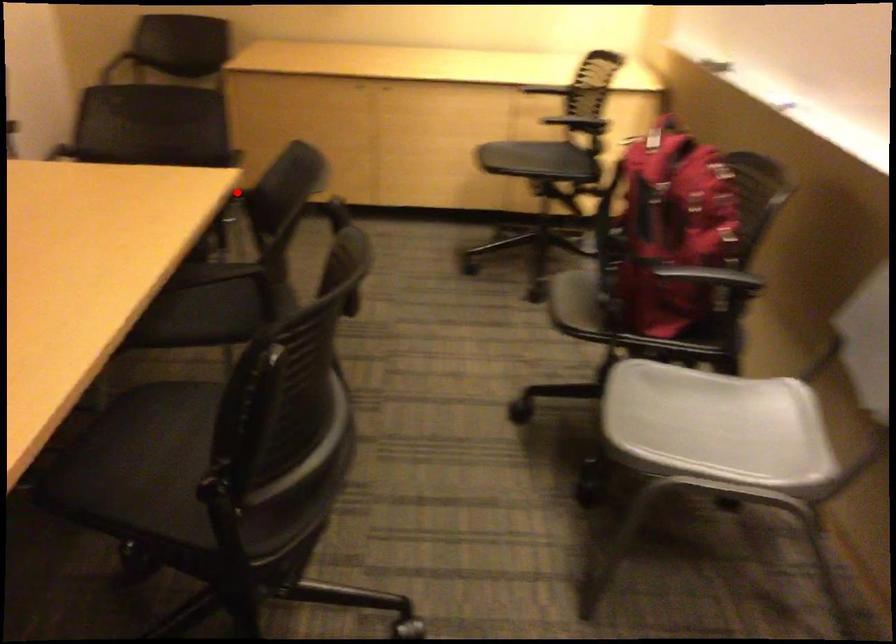
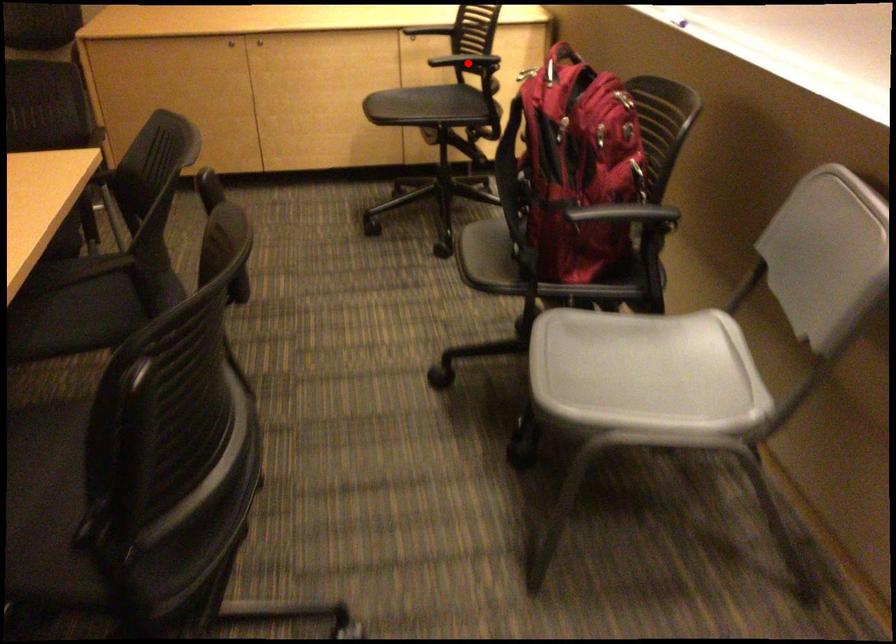
I am providing you with two images of the same scene from different viewpoints. A red point is marked on the first image and another point is marked on the second image. Is the marked point in image1 the same physical position as the marked point in image2?

No